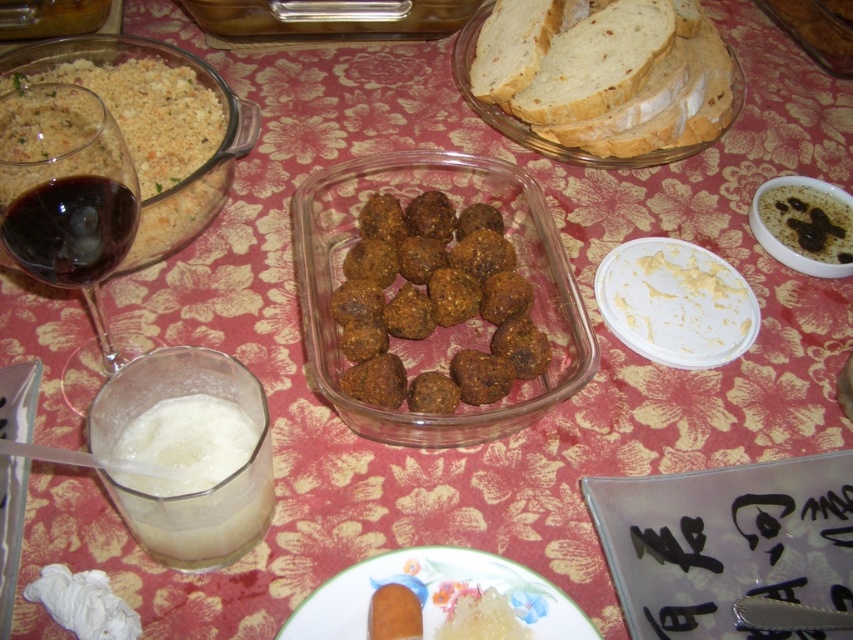
Question: Which point is closer to the camera taking this photo?

Choices:
 (A) (349, 611)
 (B) (49, 208)
 (C) (393, 381)

Answer: (B)

Question: Considering the real-world distances, which object is farthest from the brown matte meatballs at center?

Choices:
 (A) white soft bread at upper right
 (B) transparent glass wine at left

Answer: (A)

Question: Is brown crumbly meatballs at center above dark red liquid at left?

Choices:
 (A) no
 (B) yes

Answer: (A)

Question: Considering the real-world distances, which object is farthest from the transparent glass wine at left?

Choices:
 (A) brown crumbly meatballs at center
 (B) white matte plate at upper right
 (C) dark red liquid at left
 (D) brown matte meatballs at center

Answer: (B)

Question: Can you confirm if brown matte meatballs at center is positioned to the right of dark red liquid at left?

Choices:
 (A) yes
 (B) no

Answer: (A)

Question: Does white matte plate at upper right appear on the right side of black creamy soup at center?

Choices:
 (A) no
 (B) yes

Answer: (A)